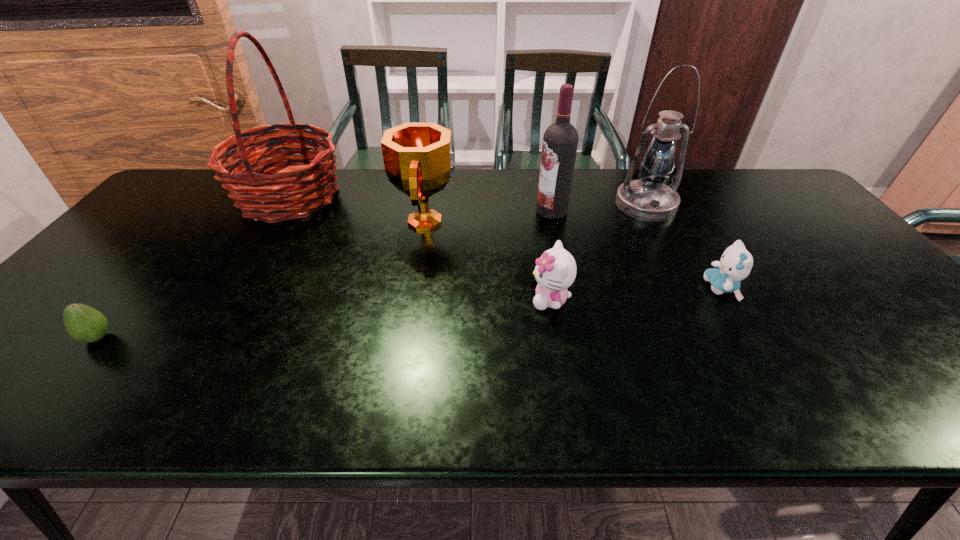
Where is `vacant region between the oil lamp and the nearest object`? This screenshot has width=960, height=540. vacant region between the oil lamp and the nearest object is located at coordinates (372, 271).

Image resolution: width=960 pixels, height=540 pixels. In order to click on free space between the wine bottle and the nearest object in this screenshot , I will do `click(324, 274)`.

Image resolution: width=960 pixels, height=540 pixels. Find the location of `object that is the third nearest to the basket`. object that is the third nearest to the basket is located at coordinates (555, 271).

Identify the location of object that is the fourth closest to the nearest object. (560, 140).

The width and height of the screenshot is (960, 540). Find the location of `vacant area in the image that satisfies the following two spatial constraints: 1. on the front-facing side of the left kitten; 2. on the front side of the leftmost object`. vacant area in the image that satisfies the following two spatial constraints: 1. on the front-facing side of the left kitten; 2. on the front side of the leftmost object is located at coordinates (557, 338).